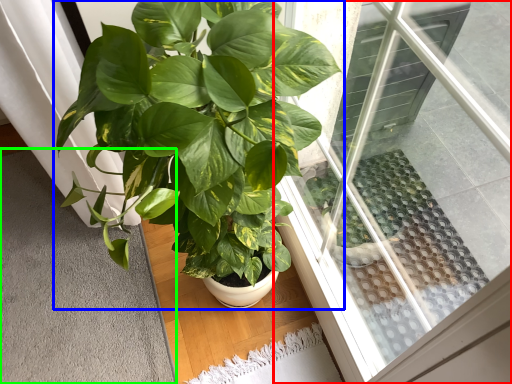
Question: Which is nearer to the window (highlighted by a red box)? houseplant (highlighted by a blue box) or gray (highlighted by a green box).

Choices:
 (A) houseplant
 (B) gray

Answer: (A)